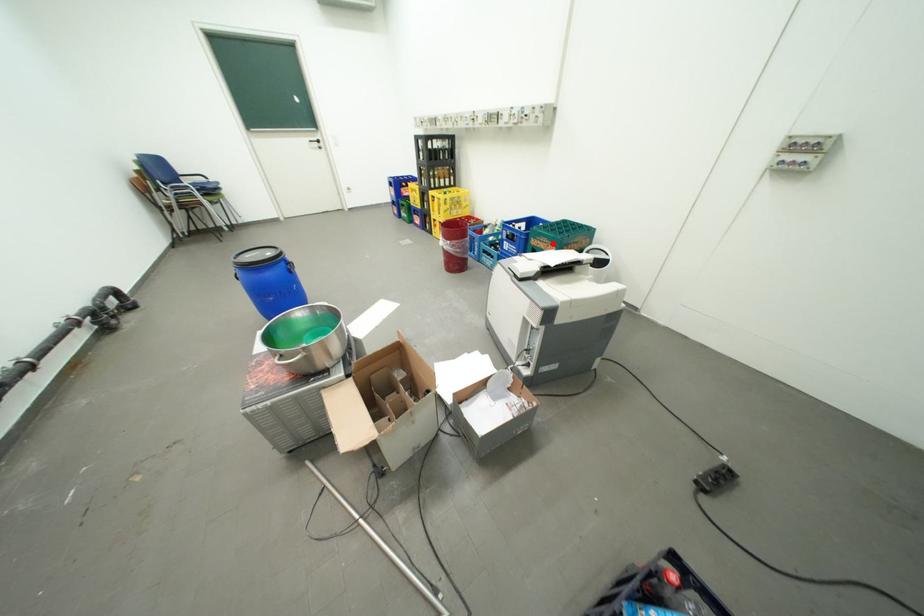
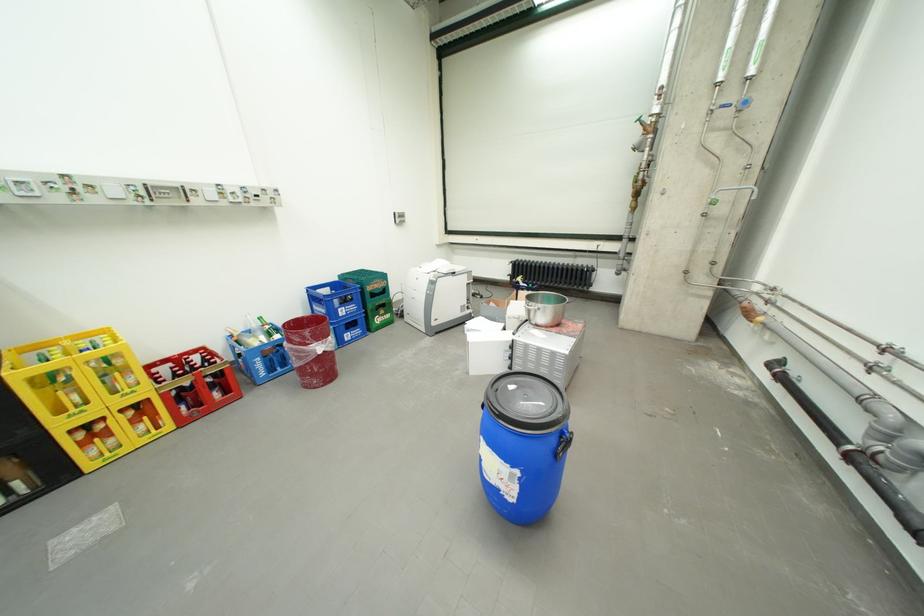
Locate, in the second image, the point that corresponds to the highlighted location in the first image.

(386, 285)